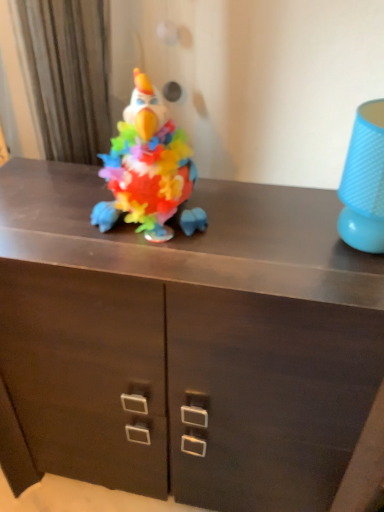
Question: In terms of width, does wooden cabinet at center look wider or thinner when compared to plush multicolored parrot at center?

Choices:
 (A) wide
 (B) thin

Answer: (A)

Question: From the image's perspective, relative to plush multicolored parrot at center, is wooden cabinet at center above or below?

Choices:
 (A) below
 (B) above

Answer: (A)

Question: Which is farther from the wooden cabinet at center?

Choices:
 (A) plush multicolored parrot at center
 (B) blue textured lampshade at right

Answer: (B)

Question: Estimate the real-world distances between objects in this image. Which object is farther from the wooden cabinet at center?

Choices:
 (A) blue textured lampshade at right
 (B) plush multicolored parrot at center

Answer: (A)